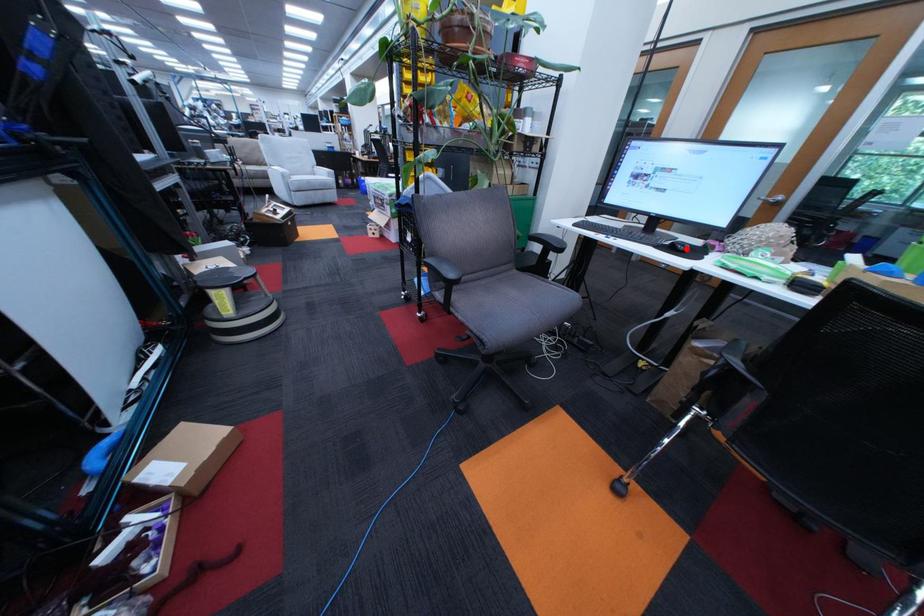
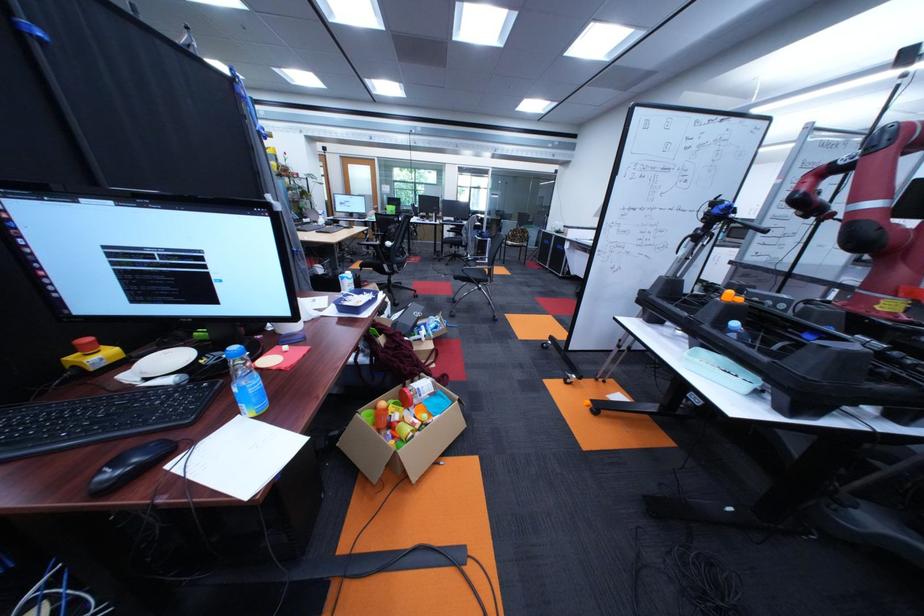
Question: I am providing you with two images of the same scene from different viewpoints. A red point is marked on the first image. Can you still see the location of the red point in image 2?

Choices:
 (A) Yes
 (B) No

Answer: (B)